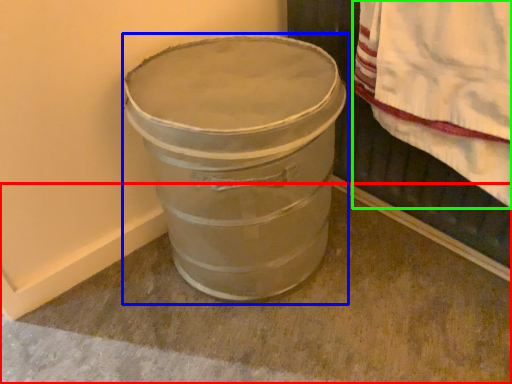
Question: Based on their relative distances, which object is farther from concrete (highlighted by a red box)? Choose from waste container (highlighted by a blue box) and blanket (highlighted by a green box).

Choices:
 (A) waste container
 (B) blanket

Answer: (B)